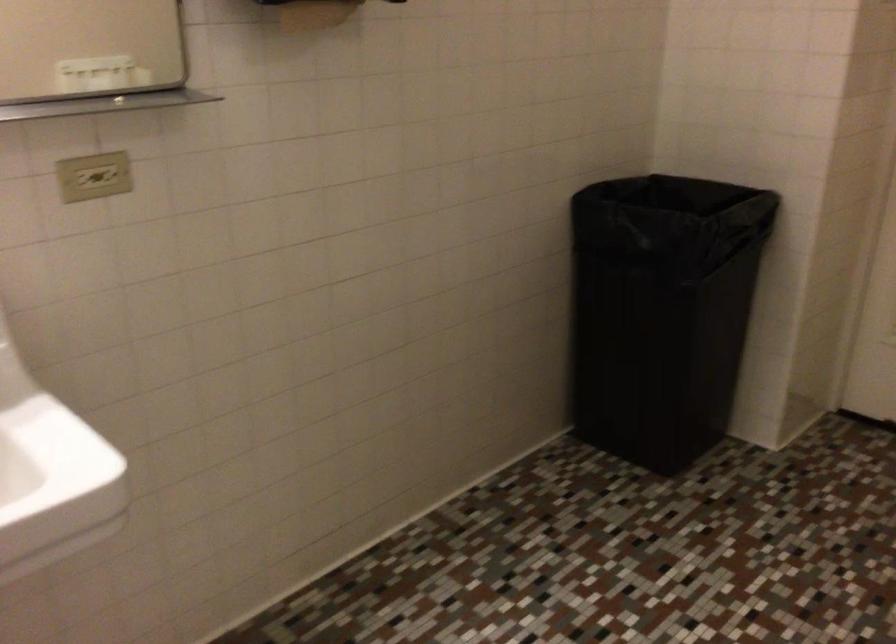
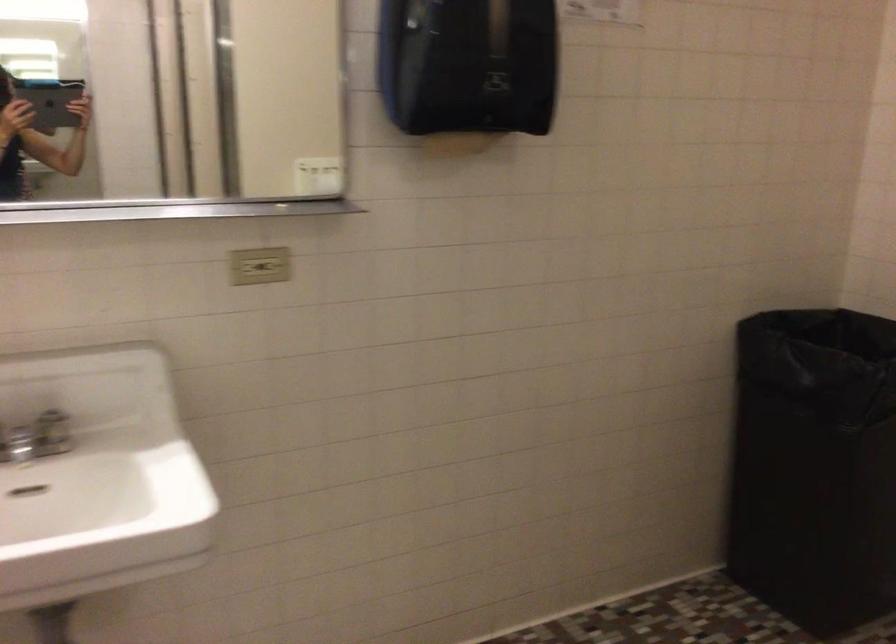
Find the pixel in the second image that matches (x=118, y=175) in the first image.

(273, 266)